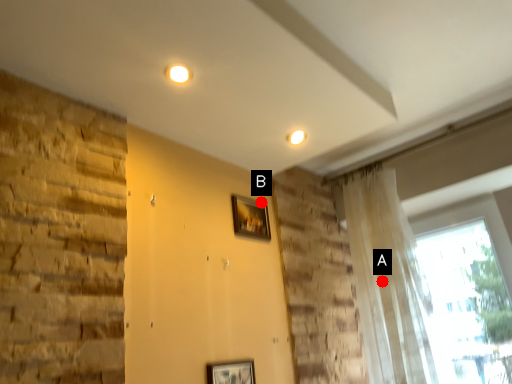
Question: Two points are circled on the image, labeled by A and B beside each circle. Which point is closer to the camera taking this photo?

Choices:
 (A) A is closer
 (B) B is closer

Answer: (A)